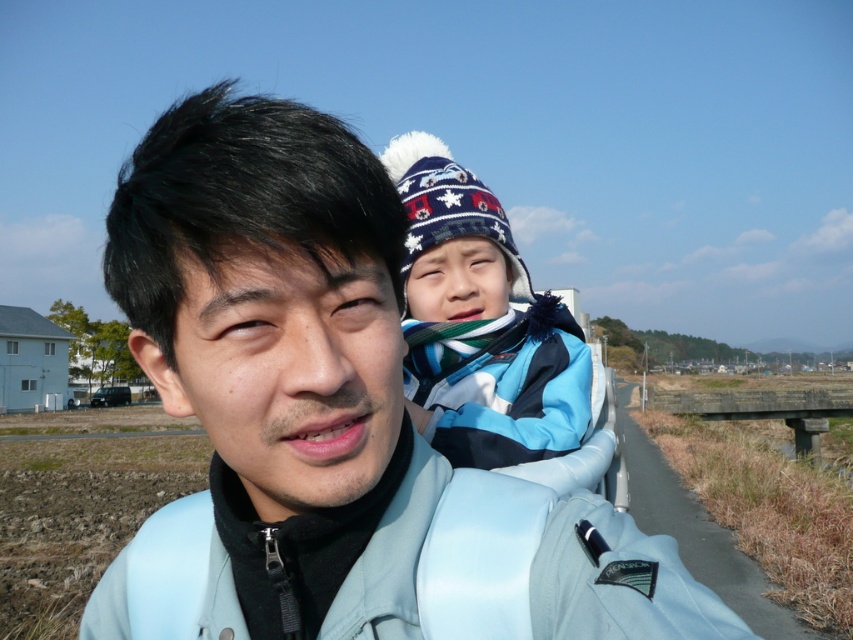
Find the location of a particular element. This screenshot has height=640, width=853. blue fleece jacket at upper center is located at coordinates (479, 323).

Which is more to the right, light blue jacket at center or blue fleece jacket at center?

blue fleece jacket at center

Which is below, light blue jacket at center or blue fleece jacket at center?

Positioned lower is blue fleece jacket at center.

Who is more forward, (596, 636) or (485, 358)?

Positioned in front is point (596, 636).

Identify the location of light blue jacket at center. This screenshot has height=640, width=853. (280, 358).

Measure the distance between light blue jacket at center and camera.

light blue jacket at center is 22.19 inches from camera.

In the scene shown: Who is higher up, light blue jacket at center or blue fleece jacket at upper center?

blue fleece jacket at upper center is above.

Identify the location of light blue jacket at center. (280, 358).